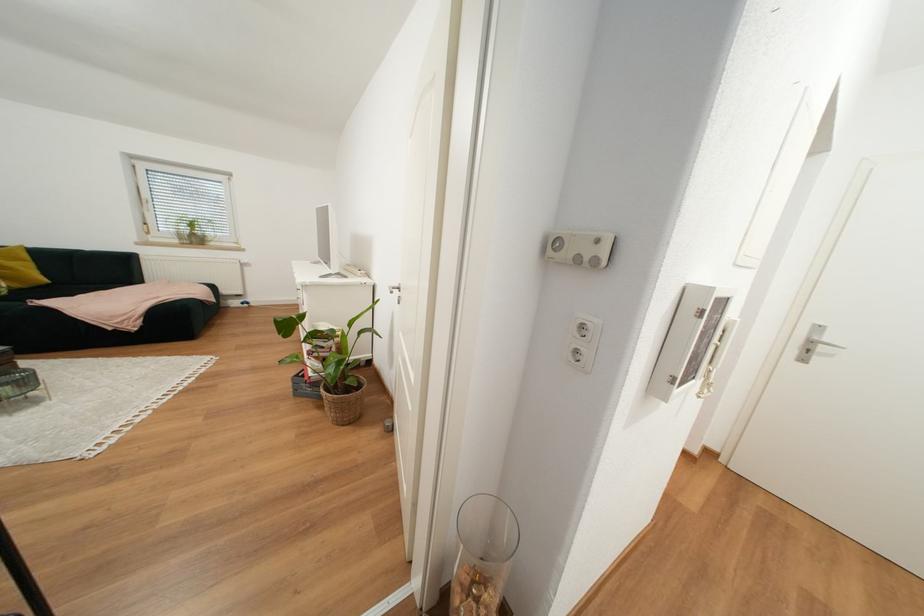
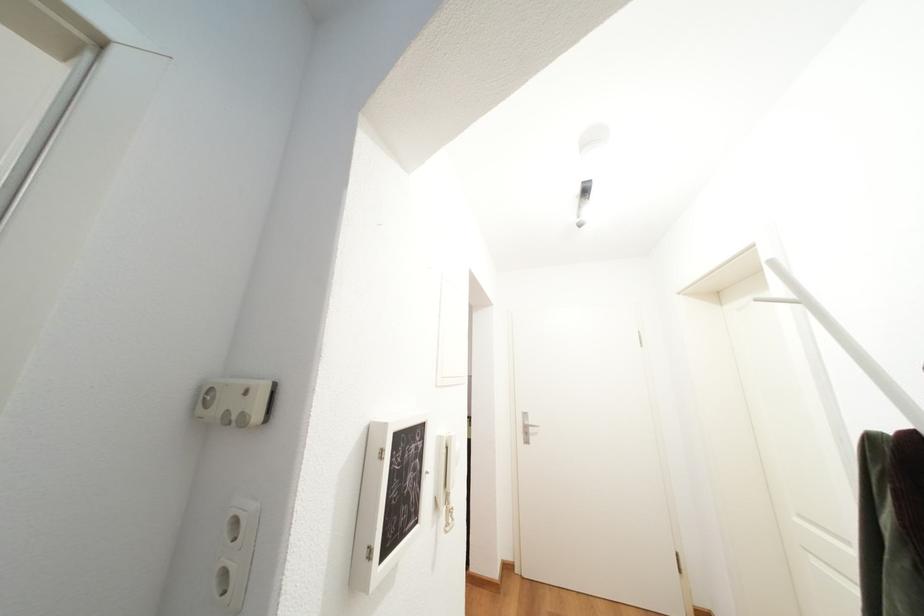
First-person continuous shooting, in which direction is the camera rotating?

The rotation direction of the camera is right-up.